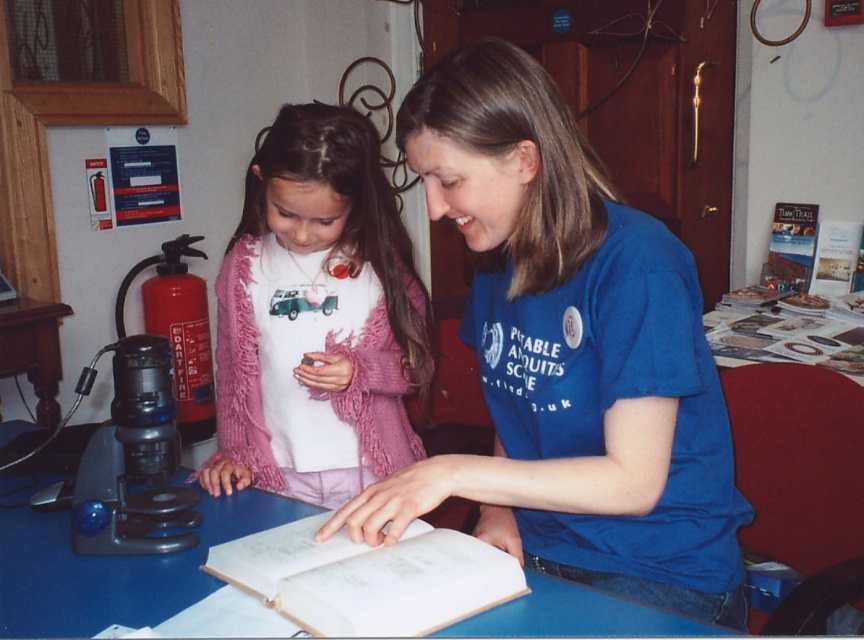
Question: Estimate the real-world distances between objects in this image. Which object is closer to the white paper book at center?

Choices:
 (A) pink fringed sweater at center
 (B) wooden table at lower left

Answer: (A)

Question: Considering the real-world distances, which object is closest to the blue plastic table at center?

Choices:
 (A) pink fringed sweater at center
 (B) wooden table at lower left
 (C) white paper book at center
 (D) blue cotton shirt at center

Answer: (C)

Question: Is pink fringed sweater at center thinner than white paper book at center?

Choices:
 (A) yes
 (B) no

Answer: (A)

Question: Can you confirm if blue cotton shirt at center is thinner than pink fringed sweater at center?

Choices:
 (A) yes
 (B) no

Answer: (B)

Question: Which object appears closest to the camera in this image?

Choices:
 (A) white paper book at center
 (B) blue plastic table at center

Answer: (A)

Question: In this image, where is blue cotton shirt at center located relative to wooden table at lower left?

Choices:
 (A) left
 (B) right

Answer: (B)